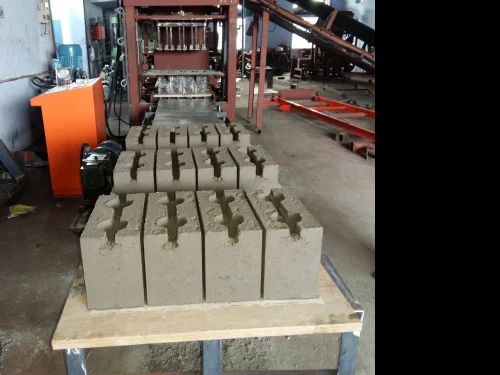
The height and width of the screenshot is (375, 500). In order to click on walls in this screenshot , I will do `click(12, 61)`, `click(89, 16)`, `click(280, 34)`, `click(368, 13)`.